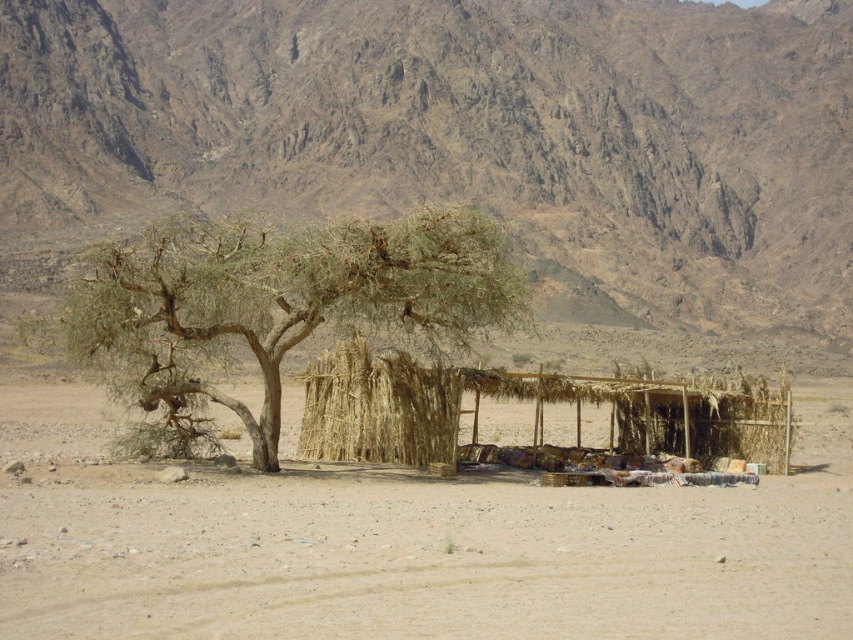
Question: Based on their relative distances, which object is nearer to the green leafy tree at center?

Choices:
 (A) brown rocky mountain at upper center
 (B) brown sandy ground at center

Answer: (B)

Question: Does brown sandy ground at center have a larger size compared to green leafy tree at center?

Choices:
 (A) no
 (B) yes

Answer: (B)

Question: Considering the real-world distances, which object is closest to the green leafy tree at center?

Choices:
 (A) brown sandy ground at center
 (B) brown rocky mountain at upper center

Answer: (A)

Question: Which point is closer to the camera?

Choices:
 (A) (339, 268)
 (B) (410, 529)

Answer: (B)

Question: In this image, where is brown rocky mountain at upper center located relative to brown sandy ground at center?

Choices:
 (A) right
 (B) left

Answer: (A)

Question: Is brown sandy ground at center below green leafy tree at center?

Choices:
 (A) no
 (B) yes

Answer: (B)